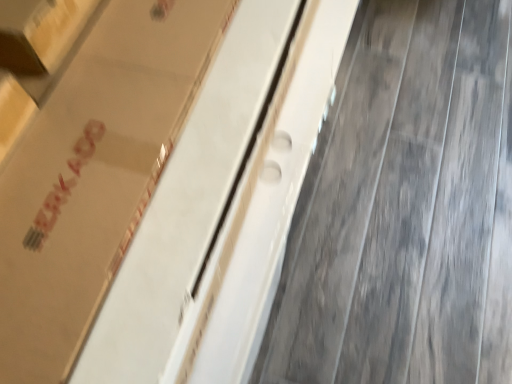
The height and width of the screenshot is (384, 512). What do you see at coordinates (94, 174) in the screenshot? I see `brown cardboard box at upper left` at bounding box center [94, 174].

Locate an element on the screen. This screenshot has height=384, width=512. brown cardboard box at upper left is located at coordinates (94, 174).

At what (x,y) coordinates should I click in order to perform the action: click on brown cardboard box at upper left. Please return your answer as a coordinate pair (x, y). The height and width of the screenshot is (384, 512). Looking at the image, I should click on (94, 174).